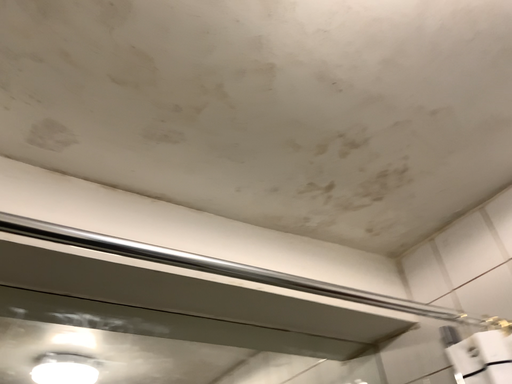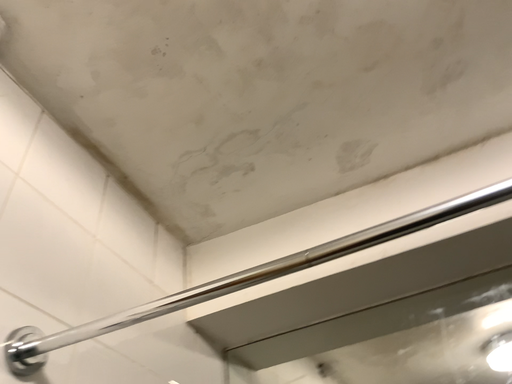
Question: How did the camera likely rotate when shooting the video?

Choices:
 (A) rotated downward
 (B) rotated upward

Answer: (A)